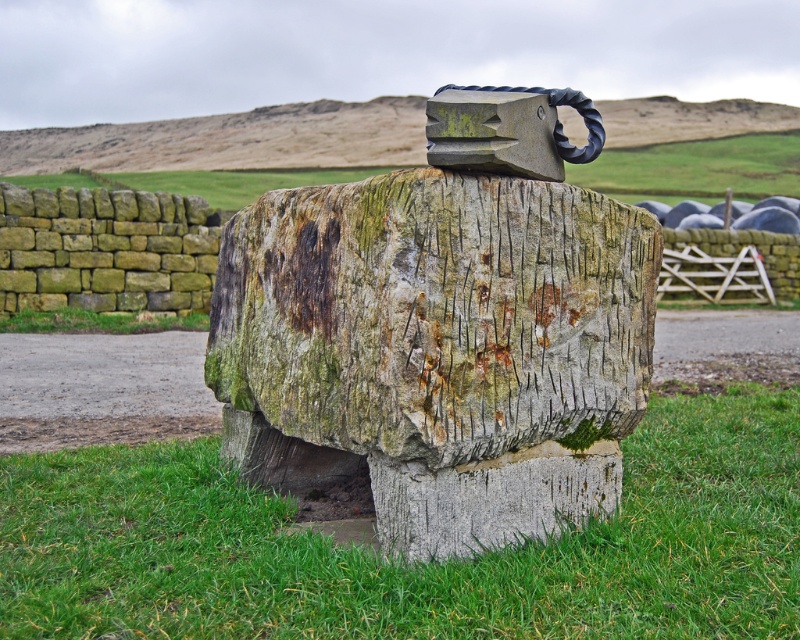
You are standing at the origin point of the coordinate system. You want to place a new decorative stone at the location of the green grass at lower center. What are the coordinates where you should place the new stone?

The coordinates for the green grass at lower center are at point (x=418, y=563), so you should place the new stone at those coordinates.

You are standing in the image and want to walk from the green grass at center to the green grass at lower center. Which direction should you move in?

You should move downward to reach the green grass at lower center from the green grass at center since the green grass at lower center is below the green grass at center.

You are a gardener who needs to mow the lawn. You observe the green grass at lower center and the green grass at center. Which area requires immediate attention based on their height?

The green grass at lower center is taller than the green grass at center, so the area with the green grass at lower center requires immediate attention for mowing.